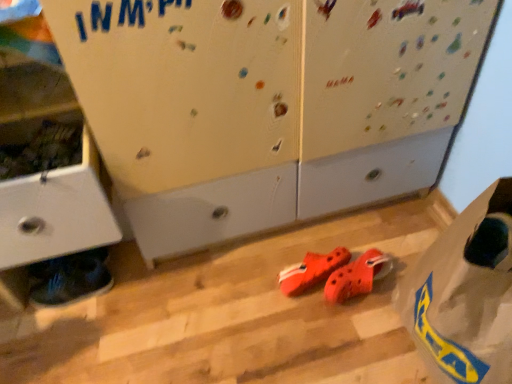
Identify the location of space that is in front of rubber/crocodile-patterned shoes at center, the 2th footwear positioned from the left. This screenshot has width=512, height=384. (315, 339).